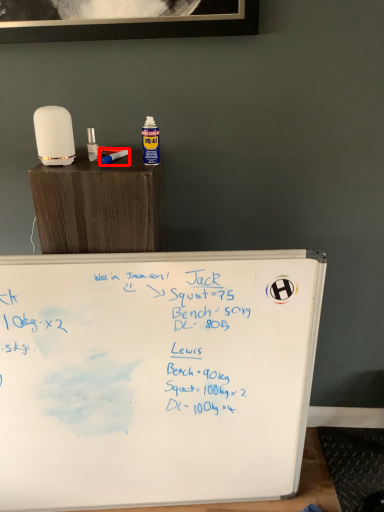
Question: From the image, what is the correct spatial relationship of paint brush (annotated by the red box) in relation to table?

Choices:
 (A) left
 (B) right

Answer: (A)